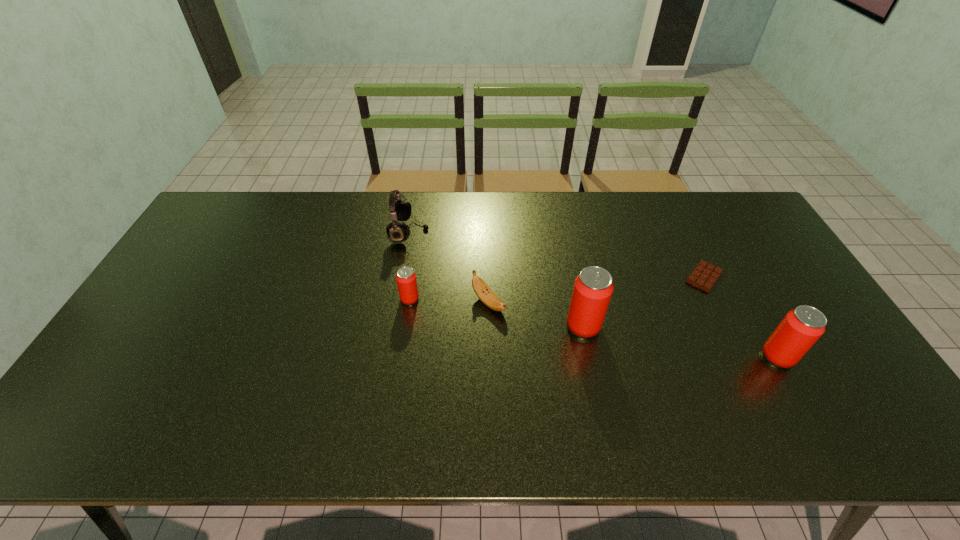
Identify the location of the third shortest object. (406, 278).

I want to click on the shortest beer can, so click(x=406, y=278).

What are the coordinates of `the second farthest beer can` in the screenshot? It's located at (593, 288).

In order to click on the third object from right to left in this screenshot , I will do `click(593, 288)`.

Locate an element on the screen. the rightmost beer can is located at coordinates (799, 330).

Find the location of a particular element. the nearest beer can is located at coordinates (799, 330).

At what (x,y) coordinates should I click in order to perform the action: click on the farthest object. Please return your answer as a coordinate pair (x, y). The width and height of the screenshot is (960, 540). Looking at the image, I should click on (400, 210).

I want to click on banana, so click(x=484, y=293).

You are a GUI agent. You are given a task and a screenshot of the screen. Output one action in this format:
    pyautogui.click(x=<x>, y=<y>)
    Task: Click on the fifth tallest object
    The width and height of the screenshot is (960, 540).
    Given the screenshot: What is the action you would take?
    pyautogui.click(x=484, y=293)

Find the location of `candy bar`. candy bar is located at coordinates (704, 276).